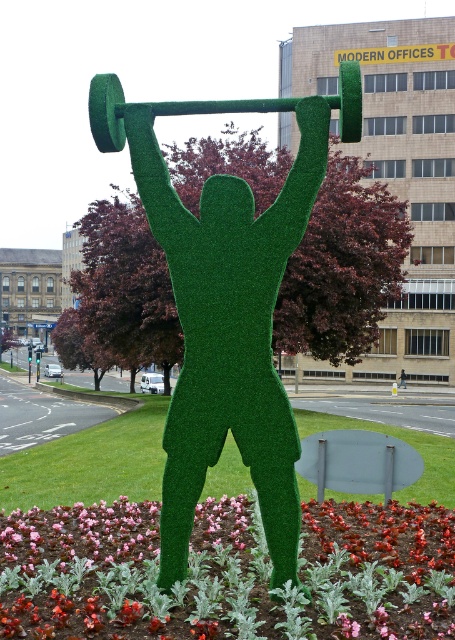
You are standing in a garden and want to take a photo of the green grassy figure at center and the green grassy barbell at upper center. Which object will appear smaller in your photo?

The green grassy barbell at upper center will appear smaller in the photo because it is further away from the viewer compared to the green grassy figure at center.

You are a maintenance worker who needs to water the pink fabric flower at center and the green grassy figure at center. Your watering can has a range of 4 feet. Can you water both objects without moving the watering can? Explain your reasoning.

The distance between the pink fabric flower at center and the green grassy figure at center is 4.30 feet. Since the watering can has a range of only 4 feet, you cannot water both objects without moving the watering can because the distance exceeds the can reach.

Consider the image. You are standing in front of the green topiary sculpture. You notice two points marked on the sculpture. The first point is at coordinate point (218, 211) and the second point is at coordinate point (157, 106). Which point is closer to you?

Point (218, 211) is closer to the viewer than point (157, 106).